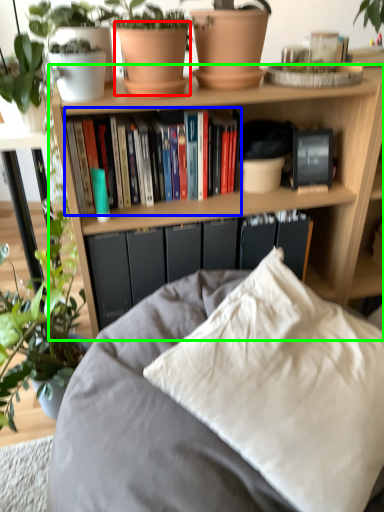
Question: Considering the real-world distances, which object is farthest from flowerpot (highlighted by a red box)? book (highlighted by a blue box) or bookcase (highlighted by a green box)?

Choices:
 (A) book
 (B) bookcase

Answer: (B)